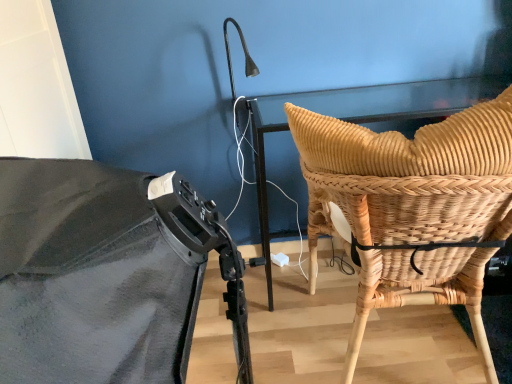
Question: Is woven natural wood chair back at right completely or partially inside woven wood chair at right?

Choices:
 (A) no
 (B) yes

Answer: (B)

Question: Would you say woven wood chair at right is outside woven natural wood chair back at right?

Choices:
 (A) yes
 (B) no

Answer: (A)

Question: Is woven wood chair at right smaller than woven natural wood chair back at right?

Choices:
 (A) no
 (B) yes

Answer: (A)

Question: Is woven wood chair at right shorter than woven natural wood chair back at right?

Choices:
 (A) no
 (B) yes

Answer: (A)

Question: Is woven wood chair at right bigger than woven natural wood chair back at right?

Choices:
 (A) yes
 (B) no

Answer: (A)

Question: Considering the relative positions of woven wood chair at right and woven natural wood chair back at right in the image provided, is woven wood chair at right to the left of woven natural wood chair back at right from the viewer's perspective?

Choices:
 (A) no
 (B) yes

Answer: (B)

Question: Is woven natural wood chair back at right closer to camera compared to woven wood chair at right?

Choices:
 (A) no
 (B) yes

Answer: (A)

Question: Is woven wood chair at right at the back of woven natural wood chair back at right?

Choices:
 (A) no
 (B) yes

Answer: (B)

Question: Does woven natural wood chair back at right appear on the left side of woven wood chair at right?

Choices:
 (A) yes
 (B) no

Answer: (B)

Question: Is woven natural wood chair back at right wider than woven wood chair at right?

Choices:
 (A) yes
 (B) no

Answer: (B)

Question: Is woven natural wood chair back at right thinner than woven wood chair at right?

Choices:
 (A) yes
 (B) no

Answer: (A)

Question: Can you confirm if woven natural wood chair back at right is bigger than woven wood chair at right?

Choices:
 (A) yes
 (B) no

Answer: (B)

Question: From a real-world perspective, is woven natural wood chair back at right above or below woven wood chair at right?

Choices:
 (A) above
 (B) below

Answer: (A)